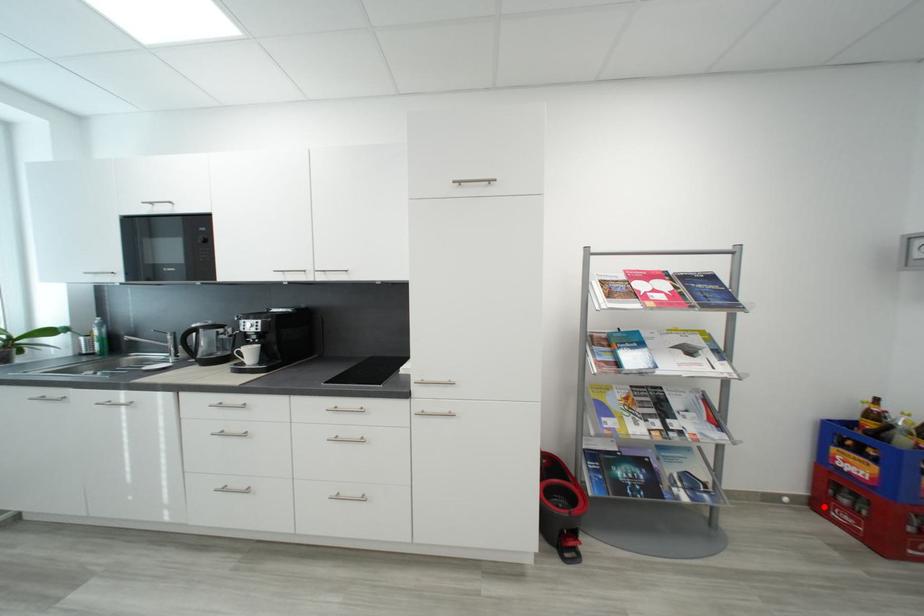
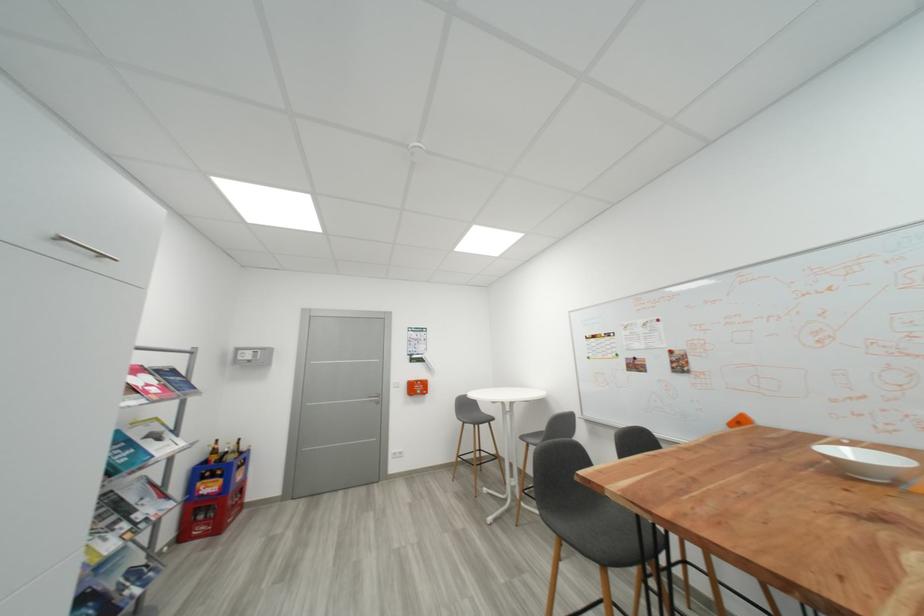
Locate, in the second image, the point that corresponds to the highlighted location in the first image.

(189, 538)